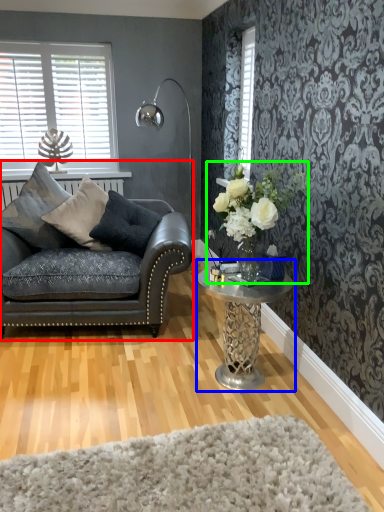
Question: Estimate the real-world distances between objects in this image. Which object is farther from studio couch (highlighted by a red box), coffee table (highlighted by a blue box) or floral arrangement (highlighted by a green box)?

Choices:
 (A) coffee table
 (B) floral arrangement

Answer: (B)